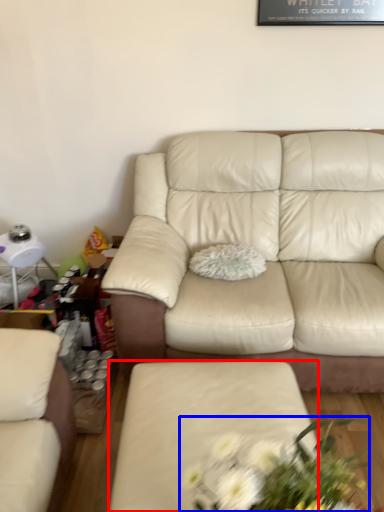
Question: Which object appears farthest to the camera in this image, couch (highlighted by a red box) or floral arrangement (highlighted by a blue box)?

Choices:
 (A) couch
 (B) floral arrangement

Answer: (A)